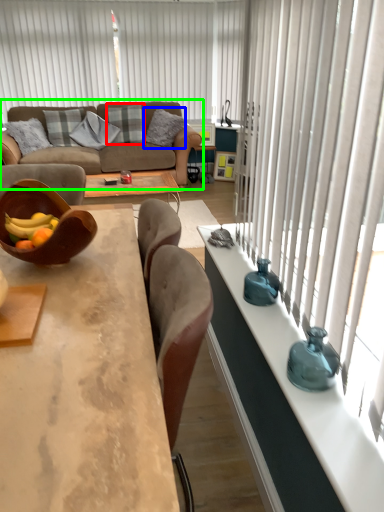
Question: Which object is the farthest from pillow (highlighted by a red box)? Choose among these: pillow (highlighted by a blue box) or studio couch (highlighted by a green box).

Choices:
 (A) pillow
 (B) studio couch

Answer: (B)